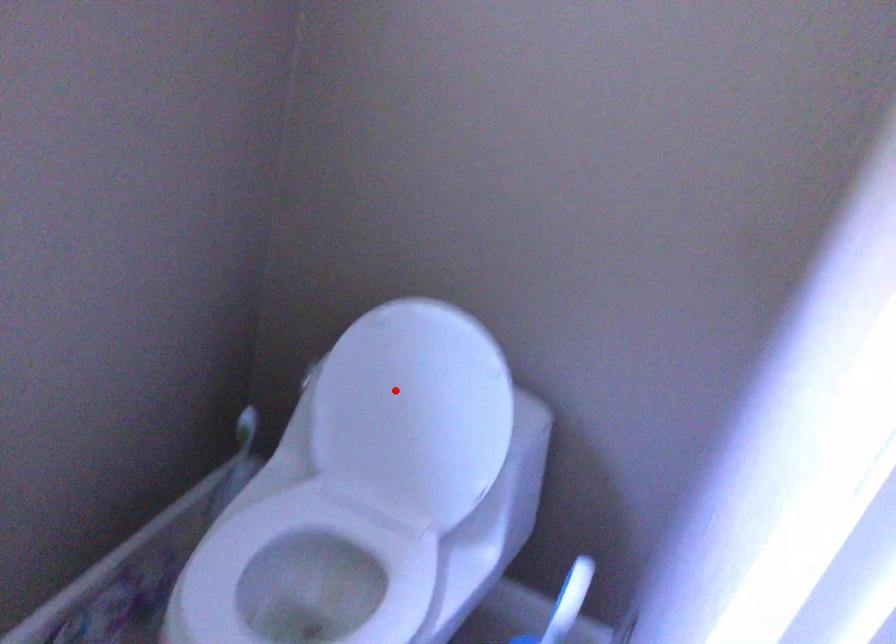
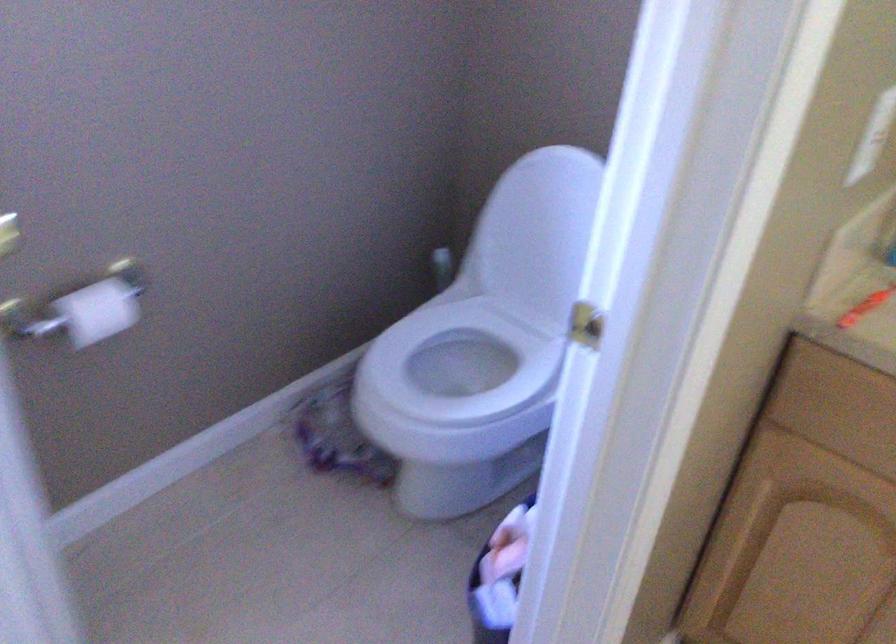
Question: I am providing you with two images of the same scene from different viewpoints. A red point is shown in image1. For the corresponding object point in image2, is it positioned nearer or farther from the camera?

Choices:
 (A) Nearer
 (B) Farther

Answer: (B)